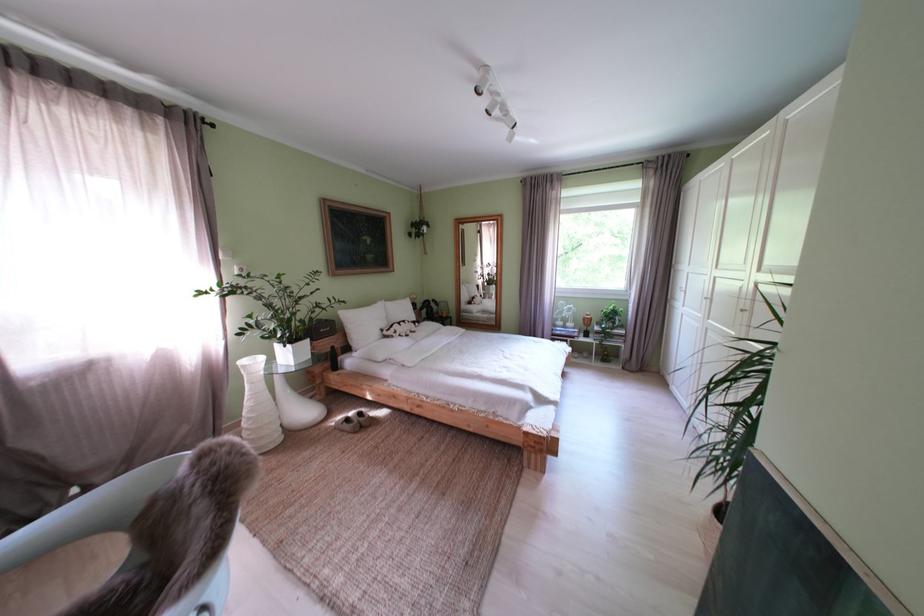
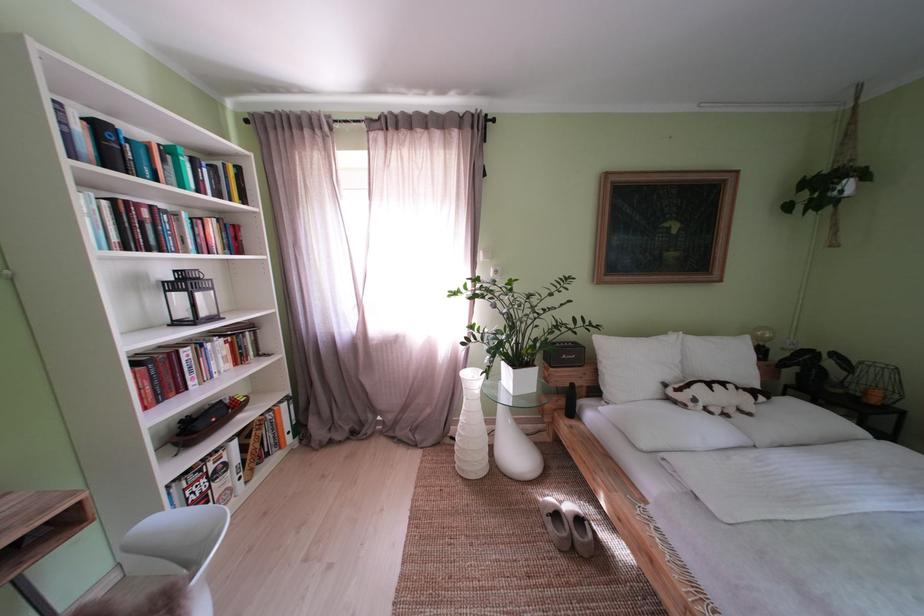
Question: The first image is from the beginning of the video and the second image is from the end. How did the camera likely rotate when shooting the video?

Choices:
 (A) Left
 (B) Right
 (C) Up
 (D) Down

Answer: (A)